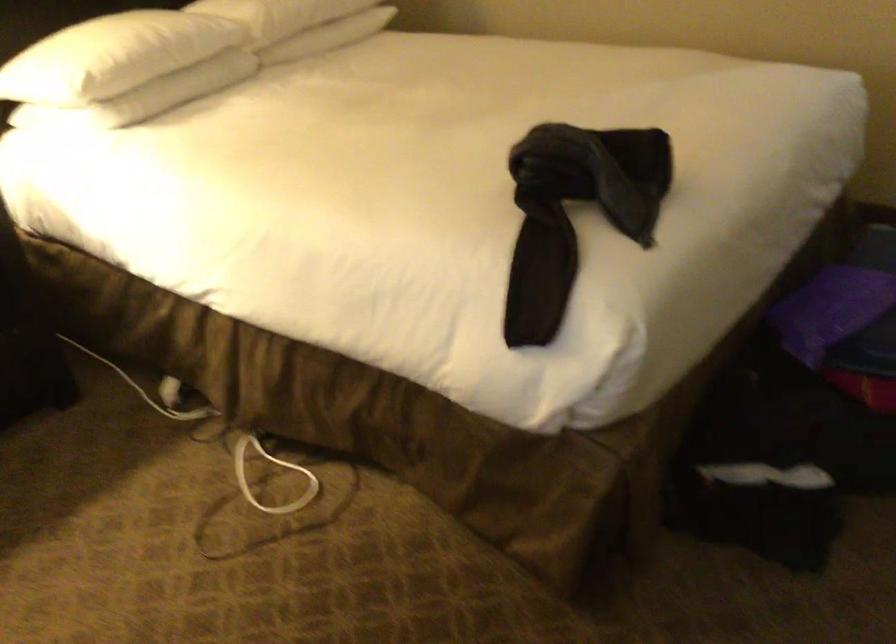
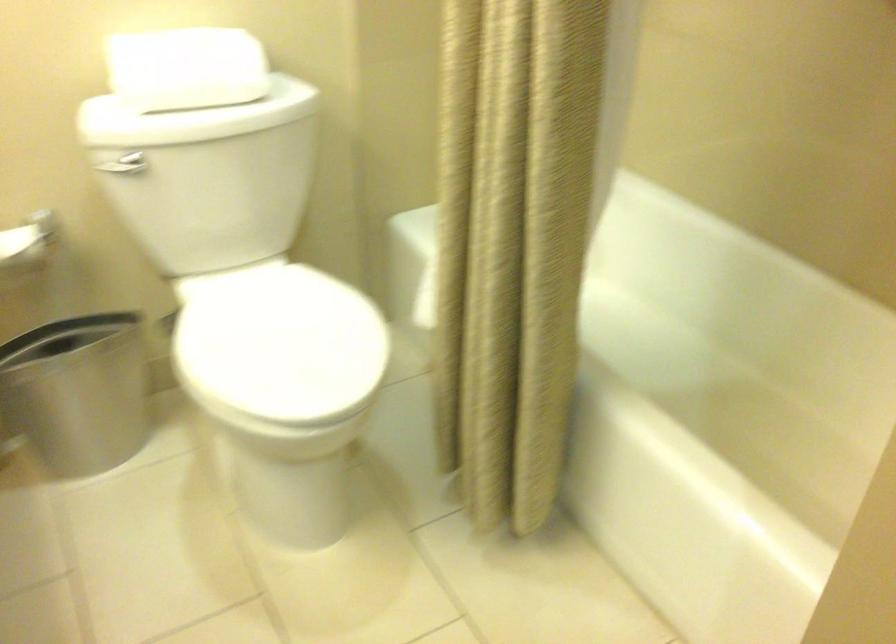
Which direction would the cameraman need to move to produce the second image?

The movement direction of the cameraman is right, forward.